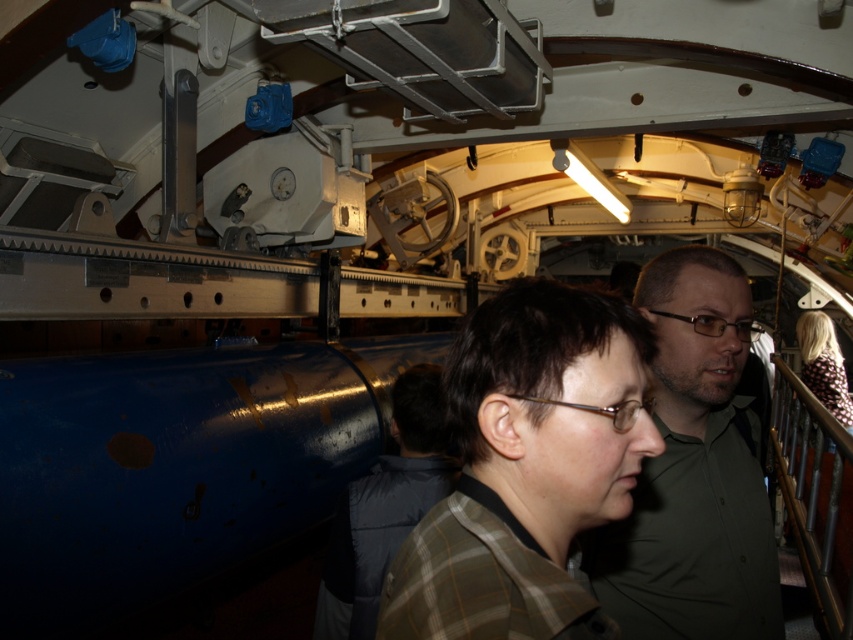
Question: Can you confirm if metallic polished rail at right is bigger than floral print dress at center?

Choices:
 (A) yes
 (B) no

Answer: (A)

Question: Considering the relative positions of metallic polished rail at right and floral print dress at center in the image provided, where is metallic polished rail at right located with respect to floral print dress at center?

Choices:
 (A) above
 (B) below

Answer: (B)

Question: Based on their relative distances, which object is farther from the metallic polished rail at right?

Choices:
 (A) plaid fabric shirt at center
 (B) floral print dress at center
 (C) green matte shirt at center

Answer: (A)

Question: Which of the following is the closest to the observer?

Choices:
 (A) (482, 460)
 (B) (813, 310)
 (C) (848, 531)
 (D) (769, 579)

Answer: (A)

Question: Which point is closer to the camera taking this photo?

Choices:
 (A) (643, 292)
 (B) (462, 525)
 (C) (805, 324)

Answer: (B)

Question: In this image, where is green matte shirt at center located relative to metallic polished rail at right?

Choices:
 (A) below
 (B) above

Answer: (B)